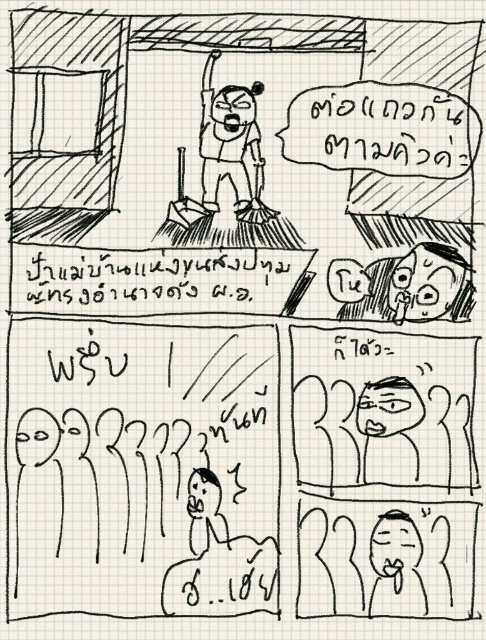
What are the coordinates of the black paper at center?

The coordinates of the black paper at center are at point (155,278).

You are a photographer standing 1.5 meters away from the black paper at center. If you want to take a clear photo of it, should you move closer or farther away?

The black paper at center is 1.08 meters away from the camera. Since you are currently 1.5 meters away, you should move closer to reach the optimal distance for a clear photo.

In the first panel of the comic strip, where is the angry face broom at upper center located in terms of coordinates?

The angry face broom at upper center is located at point coordinates of (227, 177).